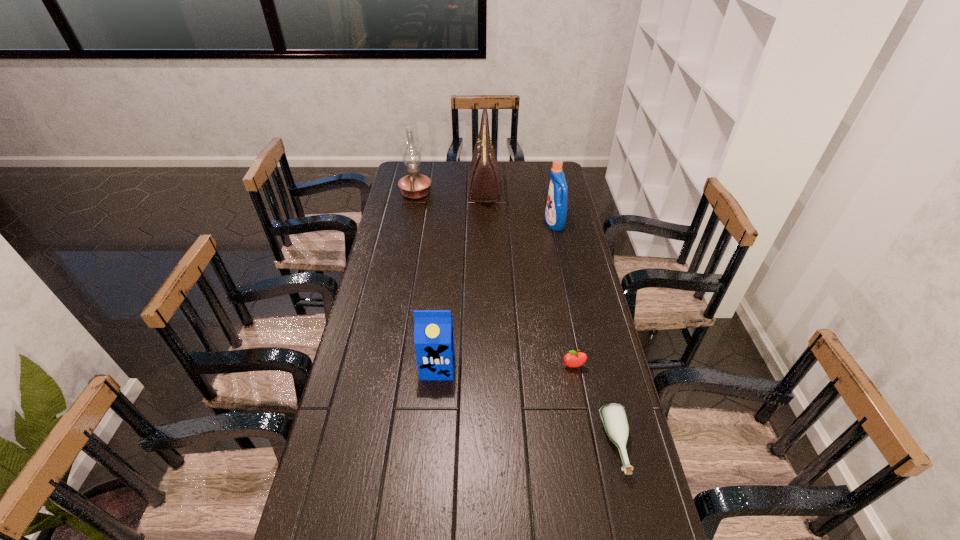
At what (x,y) coordinates should I click in order to perform the action: click on vacant space that satisfies the following two spatial constraints: 1. with the cap open on the second object from left to right; 2. on the right side of the second shortest object. Please return your answer as a coordinate pair (x, y). Looking at the image, I should click on (438, 367).